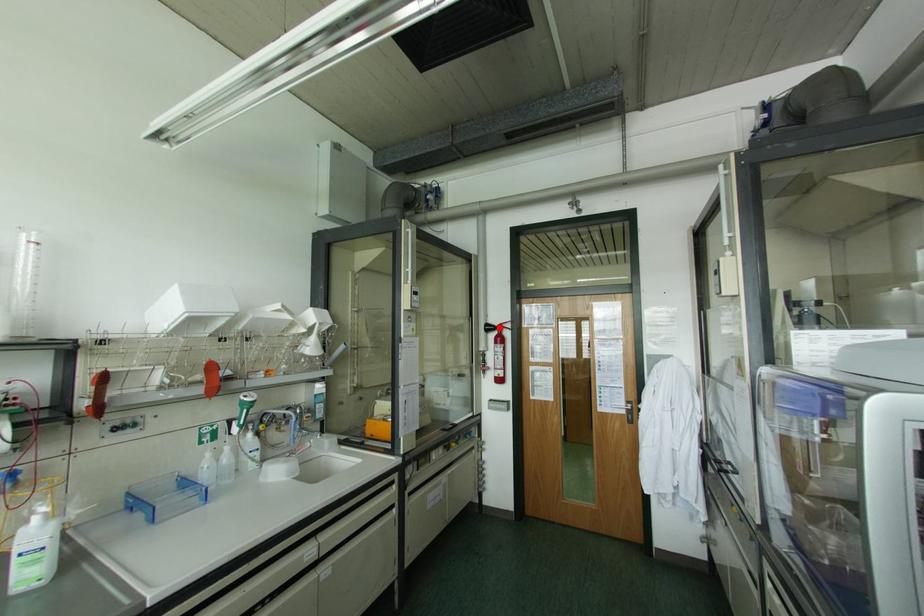
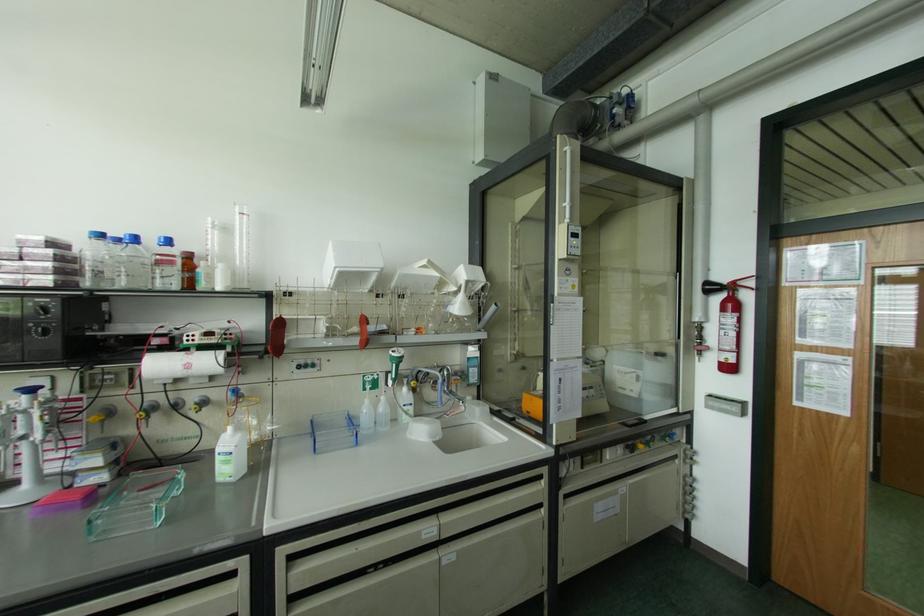
Where in the second image is the point corresponding to the highlighted location from the first image?

(732, 286)